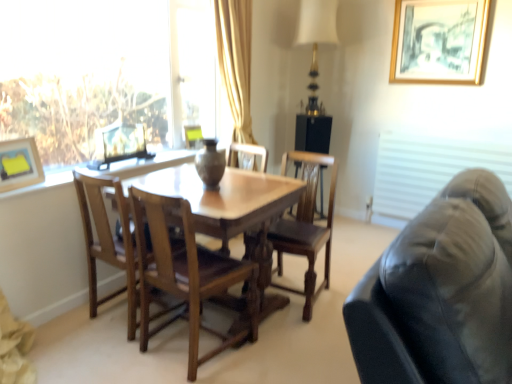
Identify the location of free space on the front side of matte yellow picture frame at center, the 3th picture frame in the front-to-back sequence. Image resolution: width=512 pixels, height=384 pixels. (189, 147).